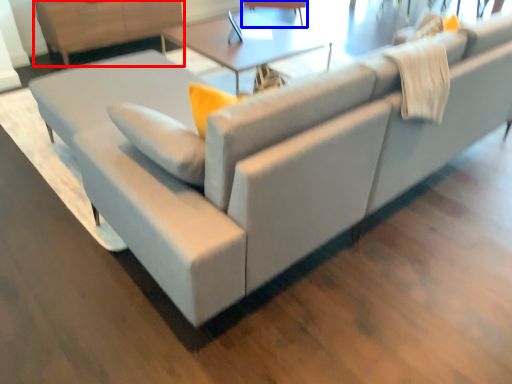
Question: Which object appears farthest to the camera in this image, dresser (highlighted by a red box) or swivel chair (highlighted by a blue box)?

Choices:
 (A) dresser
 (B) swivel chair

Answer: (B)